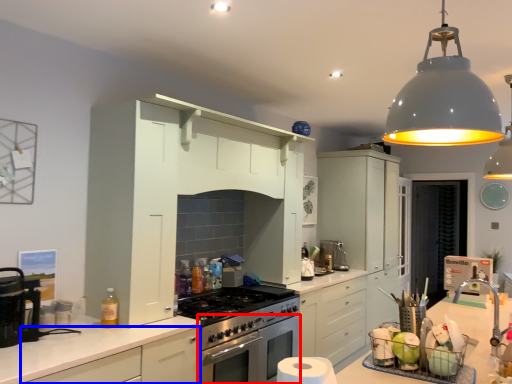
Question: Which object appears farthest to the camera in this image, oven (highlighted by a red box) or cabinetry (highlighted by a blue box)?

Choices:
 (A) oven
 (B) cabinetry

Answer: (A)